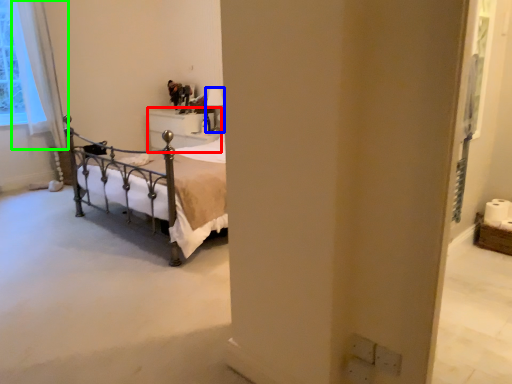
Question: Which object is positioned closest to furniture (highlighted by a red box)? Select from lamp (highlighted by a blue box) and curtain (highlighted by a green box).

Choices:
 (A) lamp
 (B) curtain

Answer: (A)